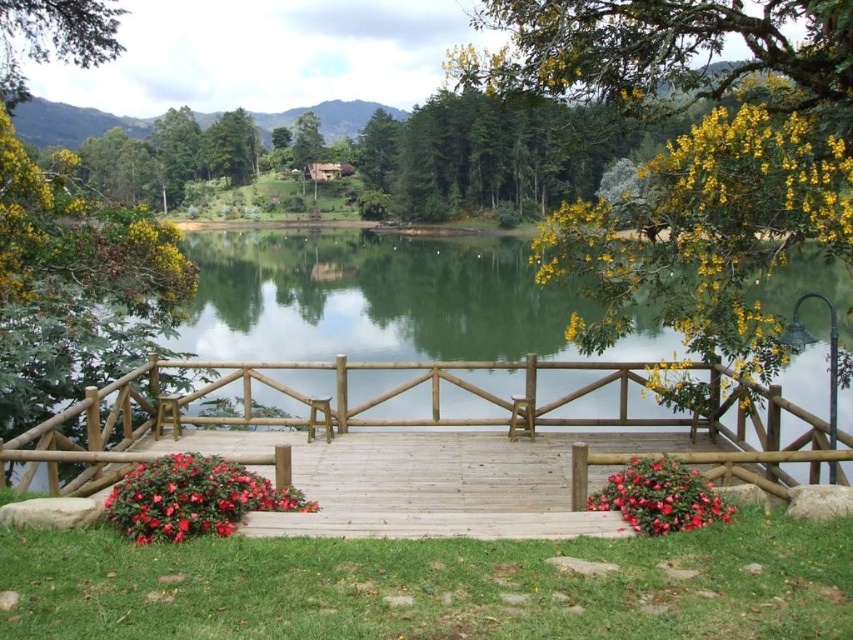
Question: Is yellow-green foliage at upper right below yellow matte flower at upper right?

Choices:
 (A) no
 (B) yes

Answer: (A)

Question: In this image, where is green leafy tree at upper center located relative to yellow matte flower at upper right?

Choices:
 (A) right
 (B) left

Answer: (B)

Question: Does red matte flower at lower right have a smaller size compared to green leafy tree at upper center?

Choices:
 (A) no
 (B) yes

Answer: (B)

Question: Which object is farther from the camera taking this photo?

Choices:
 (A) red matte flower at lower left
 (B) green leafy tree at upper center
 (C) yellow leafy tree at upper left
 (D) red matte flower at lower right

Answer: (B)

Question: Among these points, which one is farthest from the camera?

Choices:
 (A) (581, 328)
 (B) (73, 20)

Answer: (B)

Question: Among these points, which one is farthest from the camera?

Choices:
 (A) (57, 52)
 (B) (204, 168)

Answer: (B)